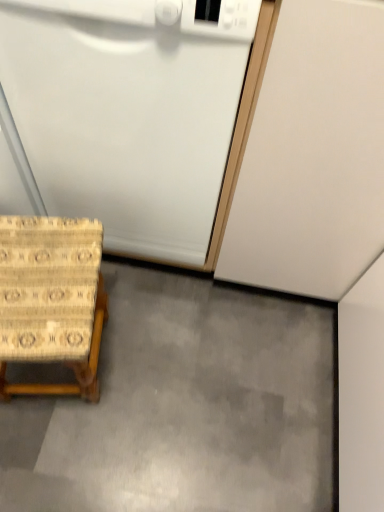
Question: Looking at their shapes, would you say white matte dishwasher at lower left is wider or thinner than gray smooth concrete at lower center?

Choices:
 (A) wide
 (B) thin

Answer: (B)

Question: Considering the relative positions of white matte dishwasher at lower left and gray smooth concrete at lower center in the image provided, is white matte dishwasher at lower left to the left or to the right of gray smooth concrete at lower center?

Choices:
 (A) left
 (B) right

Answer: (A)

Question: Estimate the real-world distances between objects in this image. Which object is closer to the white matte dishwasher at lower left?

Choices:
 (A) gray smooth concrete at lower center
 (B) beige woven stool at lower left

Answer: (B)

Question: Which object is positioned farthest from the gray smooth concrete at lower center?

Choices:
 (A) white matte dishwasher at lower left
 (B) beige woven stool at lower left

Answer: (A)